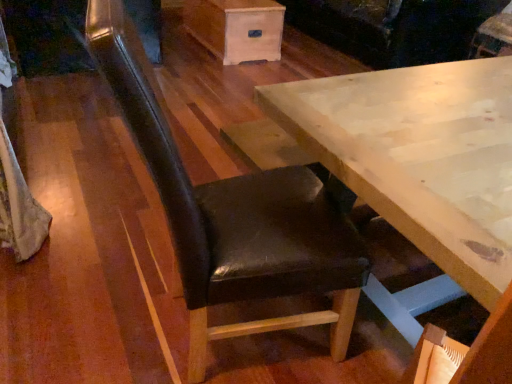
Question: Can you confirm if black leather chair at center is taller than velvet dark brown couch at upper center?

Choices:
 (A) no
 (B) yes

Answer: (B)

Question: Is black leather chair at center oriented away from velvet dark brown couch at upper center?

Choices:
 (A) no
 (B) yes

Answer: (A)

Question: From the image's perspective, does black leather chair at center appear higher than velvet dark brown couch at upper center?

Choices:
 (A) no
 (B) yes

Answer: (A)

Question: Is black leather chair at center touching velvet dark brown couch at upper center?

Choices:
 (A) yes
 (B) no

Answer: (B)

Question: Can you confirm if black leather chair at center is thinner than velvet dark brown couch at upper center?

Choices:
 (A) no
 (B) yes

Answer: (B)

Question: Is black leather chair at center smaller than velvet dark brown couch at upper center?

Choices:
 (A) yes
 (B) no

Answer: (A)

Question: Considering the relative sizes of black leather chair at center and wooden drawer at upper center in the image provided, is black leather chair at center smaller than wooden drawer at upper center?

Choices:
 (A) yes
 (B) no

Answer: (B)

Question: Is black leather chair at center aimed at wooden drawer at upper center?

Choices:
 (A) no
 (B) yes

Answer: (A)

Question: From the image's perspective, would you say black leather chair at center is shown under wooden drawer at upper center?

Choices:
 (A) yes
 (B) no

Answer: (A)

Question: From the image's perspective, is black leather chair at center on wooden drawer at upper center?

Choices:
 (A) yes
 (B) no

Answer: (B)

Question: Would you say black leather chair at center contains wooden drawer at upper center?

Choices:
 (A) yes
 (B) no

Answer: (B)

Question: Is black leather chair at center looking in the opposite direction of wooden drawer at upper center?

Choices:
 (A) yes
 (B) no

Answer: (B)

Question: Does velvet dark brown couch at upper center have a greater width compared to wooden drawer at upper center?

Choices:
 (A) yes
 (B) no

Answer: (A)